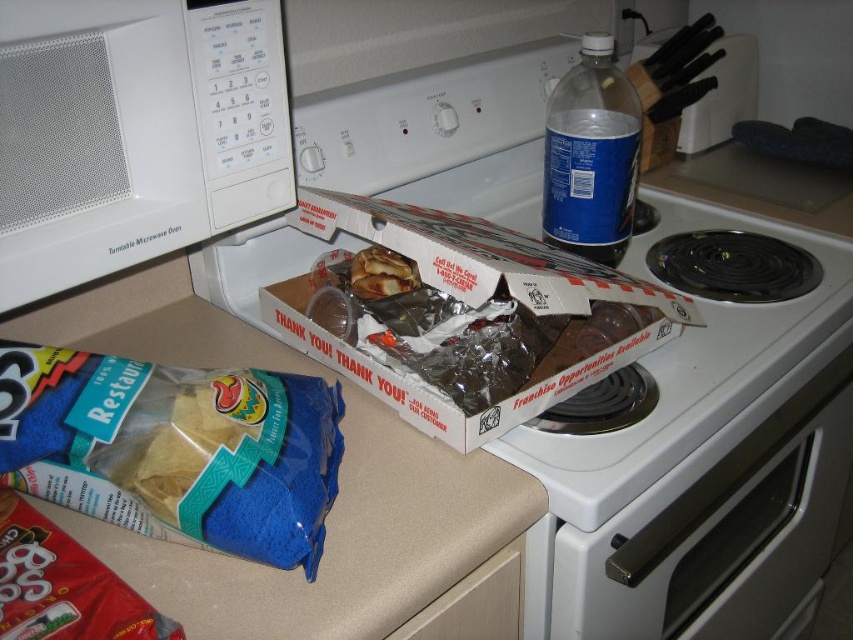
Based on the photo, which is above, white glossy oven at lower right or white cardboard box at center?

white cardboard box at center is higher up.

Can you confirm if white glossy oven at lower right is shorter than white cardboard box at center?

No.

Is point (695, 515) closer to viewer compared to point (351, 374)?

Yes, point (695, 515) is in front of point (351, 374).

This screenshot has height=640, width=853. I want to click on white glossy oven at lower right, so click(721, 522).

Is white glossy oven at lower right to the left of golden crispy bread at center from the viewer's perspective?

Incorrect, white glossy oven at lower right is not on the left side of golden crispy bread at center.

Describe the element at coordinates (721, 522) in the screenshot. I see `white glossy oven at lower right` at that location.

The width and height of the screenshot is (853, 640). What are the coordinates of `white glossy oven at lower right` in the screenshot? It's located at (721, 522).

Between blue plastic bottle at upper right and golden crispy bread at center, which one is positioned lower?

golden crispy bread at center is below.

Is blue plastic bottle at upper right to the right of golden crispy bread at center from the viewer's perspective?

Yes, blue plastic bottle at upper right is to the right of golden crispy bread at center.

You are a GUI agent. You are given a task and a screenshot of the screen. Output one action in this format:
    pyautogui.click(x=<x>, y=<y>)
    Task: Click on the blue plastic bottle at upper right
    
    Given the screenshot: What is the action you would take?
    pyautogui.click(x=590, y=156)

The height and width of the screenshot is (640, 853). I want to click on blue plastic bottle at upper right, so click(590, 156).